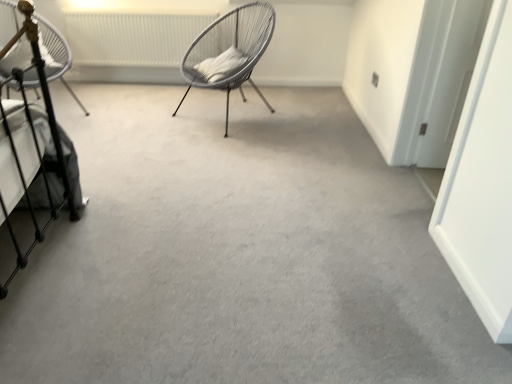
Image resolution: width=512 pixels, height=384 pixels. In order to click on vacant space in white textured radiator at upper center (from a real-world perspective) in this screenshot , I will do `click(140, 75)`.